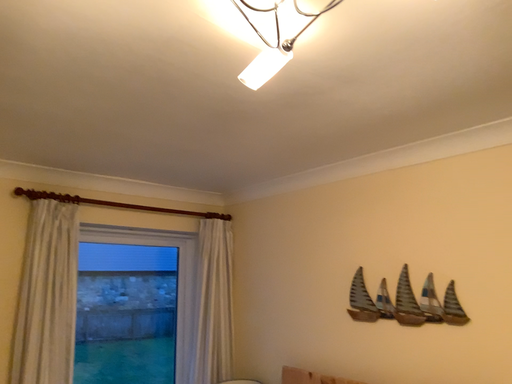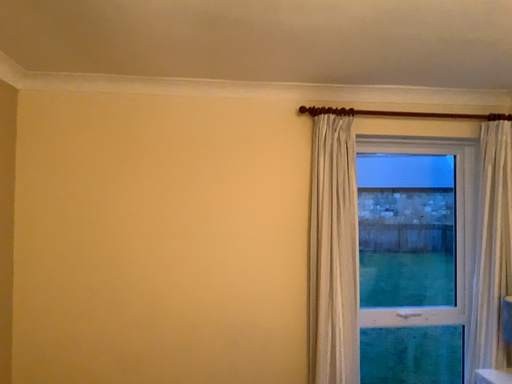
Question: How did the camera likely rotate when shooting the video?

Choices:
 (A) rotated downward
 (B) rotated upward

Answer: (A)